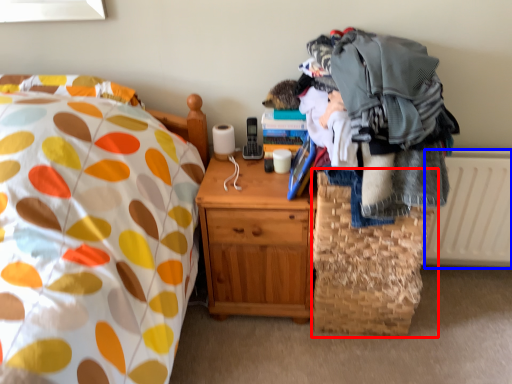
Question: Which object is closer to the camera taking this photo, basket (highlighted by a red box) or radiator (highlighted by a blue box)?

Choices:
 (A) basket
 (B) radiator

Answer: (A)